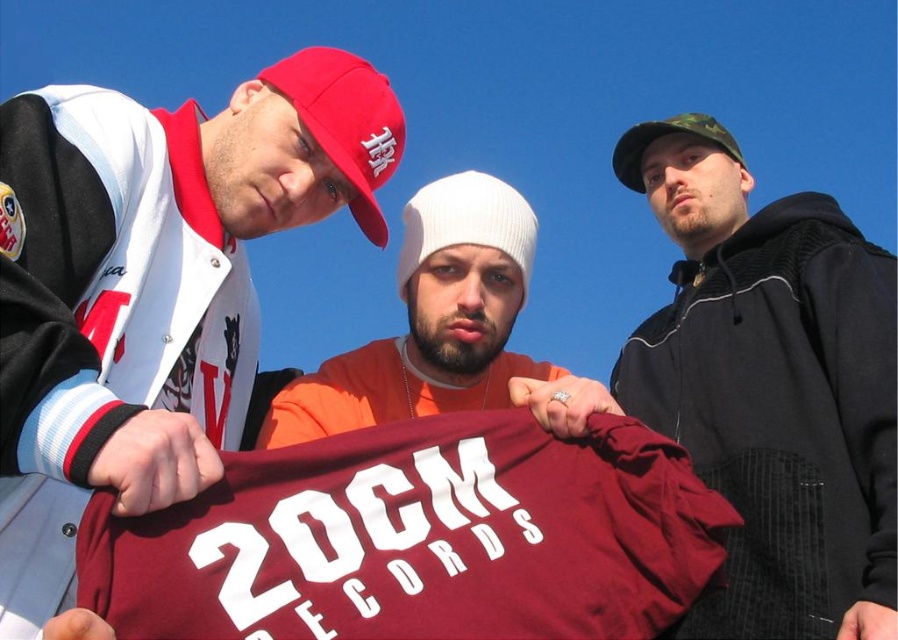
You are a photographer adjusting your camera to focus on two points in the scene. The first point is at coordinates point (353, 124) and the second is at point (639, 164). Which point should you focus on first if you want to capture the closest object to the camera?

You should focus on point (353, 124) first because it is closer to the viewer than point (639, 164).